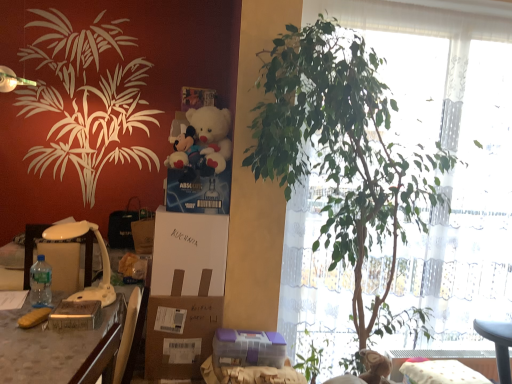
I want to click on purple plastic container at lower center, marked as the 2th gift in a top-to-bottom arrangement, so click(x=248, y=348).

Image resolution: width=512 pixels, height=384 pixels. What do you see at coordinates (180, 335) in the screenshot?
I see `brown cardboard box at center` at bounding box center [180, 335].

What is the approximate height of wooden desk at left?

The height of wooden desk at left is 22.51 inches.

Measure the distance between clear plastic bottle at left and camera.

clear plastic bottle at left is 1.95 meters away from camera.

Where is `purple plastic container at lower center, the 1th gift when ordered from bottom to top`? purple plastic container at lower center, the 1th gift when ordered from bottom to top is located at coordinates (248, 348).

In the image, is green leafy plant at center positioned in front of or behind clear plastic bottle at left?

In the image, green leafy plant at center appears in front of clear plastic bottle at left.

Considering the sizes of green leafy plant at center and clear plastic bottle at left in the image, is green leafy plant at center bigger or smaller than clear plastic bottle at left?

In the image, green leafy plant at center appears to be larger than clear plastic bottle at left.

From a real-world perspective, is green leafy plant at center positioned under clear plastic bottle at left based on gravity?

No, from a real-world perspective, green leafy plant at center is not under clear plastic bottle at left.

From the image's perspective, is green leafy plant at center on top of clear plastic bottle at left?

Yes.

Considering the sizes of brown cardboard box at center and white cardboard box at center in the image, is brown cardboard box at center taller or shorter than white cardboard box at center?

Clearly, brown cardboard box at center is shorter compared to white cardboard box at center.

In the scene shown: From a real-world perspective, which is physically above, brown cardboard box at center or white cardboard box at center?

white cardboard box at center.

From the picture: From the image's perspective, is brown cardboard box at center above or below white cardboard box at center?

brown cardboard box at center is situated lower than white cardboard box at center in the image.

Looking at this image, considering the positions of objects brown cardboard box at center and white cardboard box at center in the image provided, who is behind, brown cardboard box at center or white cardboard box at center?

brown cardboard box at center is behind.

Is point (101, 238) in front of point (121, 292)?

No.

Considering the relative sizes of white plastic lamp at left and wooden desk at left in the image provided, is white plastic lamp at left taller than wooden desk at left?

No.

How many degrees apart are the facing directions of white plastic lamp at left and wooden desk at left?

86.6 degrees separate the facing orientations of white plastic lamp at left and wooden desk at left.

From the image's perspective, which one is positioned higher, white plastic lamp at left or wooden desk at left?

white plastic lamp at left appears higher in the image.

Looking at this image, from a real-world perspective, which object rests below the other?

metallic gold box at lower left, the 1th gift viewed from the left, from a real-world perspective.

Which of these two, white plush teddy bear at upper center or metallic gold box at lower left, positioned as the 1th gift in front-to-back order, is smaller?

Smaller between the two is metallic gold box at lower left, positioned as the 1th gift in front-to-back order.

In the scene shown: Who is taller, white plush teddy bear at upper center or metallic gold box at lower left, the second gift ordered from the bottom?

With more height is white plush teddy bear at upper center.

The height and width of the screenshot is (384, 512). What are the coordinates of `gift on the left of white plush teddy bear at upper center` in the screenshot? It's located at (75, 315).

Which object is closer to the camera, green leafy plant at center or white plush teddy bear at upper center?

green leafy plant at center.

How many degrees apart are the facing directions of green leafy plant at center and white plush teddy bear at upper center?

They differ by 1.35 degrees in their facing directions.

From a real-world perspective, is green leafy plant at center on top of white plush teddy bear at upper center?

No, from a real-world perspective, green leafy plant at center is not on top of white plush teddy bear at upper center.

I want to click on teddy bear that is above the green leafy plant at center (from a real-world perspective), so click(x=212, y=134).

Could you tell me if brown cardboard box at center is facing clear plastic bottle at left?

Yes.

Can you confirm if brown cardboard box at center is shorter than clear plastic bottle at left?

Incorrect, the height of brown cardboard box at center does not fall short of that of clear plastic bottle at left.

Who is bigger, brown cardboard box at center or clear plastic bottle at left?

Bigger between the two is brown cardboard box at center.

From the image's perspective, who appears lower, brown cardboard box at center or clear plastic bottle at left?

brown cardboard box at center is shown below in the image.

Can you see brown cardboard box at center touching metallic gold box at lower left, the second gift ordered from the bottom?

They are not placed beside each other.

Is brown cardboard box at center looking in the opposite direction of metallic gold box at lower left, the second gift ordered from the bottom?

brown cardboard box at center is not turned away from metallic gold box at lower left, the second gift ordered from the bottom.

Considering the relative sizes of brown cardboard box at center and metallic gold box at lower left, arranged as the 2th gift when viewed from the right, in the image provided, is brown cardboard box at center smaller than metallic gold box at lower left, arranged as the 2th gift when viewed from the right,?

Incorrect, brown cardboard box at center is not smaller in size than metallic gold box at lower left, arranged as the 2th gift when viewed from the right.

In the image, is brown cardboard box at center on the left side or the right side of metallic gold box at lower left, the 1th gift viewed from the left?

brown cardboard box at center is positioned on metallic gold box at lower left, the 1th gift viewed from the left,'s right side.

Locate an element on the screen. Image resolution: width=512 pixels, height=384 pixels. bottle below the green leafy plant at center (from the image's perspective) is located at coordinates (40, 283).

Find the location of a particular element. This screenshot has height=384, width=512. cardboard box located underneath the white cardboard box at center (from a real-world perspective) is located at coordinates (180, 335).

Based on their spatial positions, is white plush teddy bear at upper center or metallic gold box at lower left, the 1th gift viewed from the left, further from white cardboard box at center?

Based on the image, white plush teddy bear at upper center appears to be further to white cardboard box at center.

Looking at this image, based on their spatial positions, is white plastic lamp at left or white plush teddy bear at upper center closer to purple plastic container at lower center, arranged as the first gift when viewed from the back?

Based on the image, white plastic lamp at left appears to be nearer to purple plastic container at lower center, arranged as the first gift when viewed from the back.

Based on their spatial positions, is white plastic lamp at left or purple plastic container at lower center, marked as the 2th gift in a top-to-bottom arrangement, closer to brown cardboard box at center?

purple plastic container at lower center, marked as the 2th gift in a top-to-bottom arrangement, lies closer to brown cardboard box at center than the other object.

From the image, which object appears to be farther from white cardboard box at center, metallic gold box at lower left, positioned as the second gift in back-to-front order, or green leafy plant at center?

Based on the image, green leafy plant at center appears to be further to white cardboard box at center.

Consider the image. Which object lies further to the anchor point clear plastic bottle at left, wooden desk at left or white plastic lamp at left?

wooden desk at left.

Looking at this image, from the image, which object appears to be nearer to white cardboard box at center, green leafy plant at center or white plastic lamp at left?

white plastic lamp at left lies closer to white cardboard box at center than the other object.

Looking at this image, based on their spatial positions, is wooden desk at left or brown cardboard box at center further from green leafy plant at center?

Among the two, wooden desk at left is located further to green leafy plant at center.

From the picture: Which object lies further to the anchor point white cardboard box at center, clear plastic bottle at left or white plush teddy bear at upper center?

clear plastic bottle at left is further to white cardboard box at center.

The image size is (512, 384). Find the location of `desk located between clear plastic bottle at left and purple plastic container at lower center, positioned as the 2th gift in front-to-back order, in the left-right direction`. desk located between clear plastic bottle at left and purple plastic container at lower center, positioned as the 2th gift in front-to-back order, in the left-right direction is located at coordinates (66, 346).

The image size is (512, 384). What are the coordinates of `cardboard box located between white plastic lamp at left and green leafy plant at center in the left-right direction` in the screenshot? It's located at (180, 335).

What are the coordinates of `gift between wooden desk at left and green leafy plant at center` in the screenshot? It's located at (248, 348).

The width and height of the screenshot is (512, 384). I want to click on gift between white plastic lamp at left and white cardboard box at center, so click(x=75, y=315).